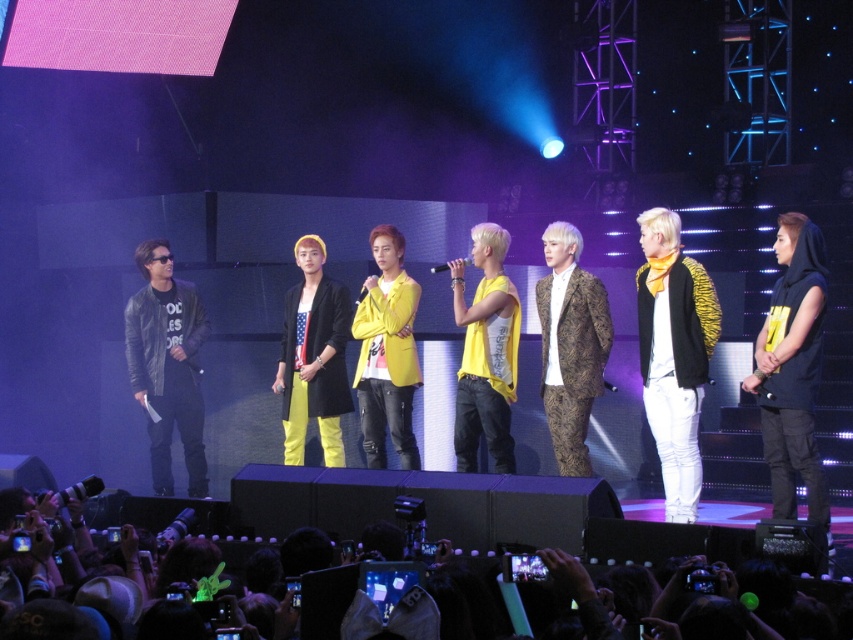
Question: Can you confirm if brown textured suit at center is positioned to the right of yellow fabric jacket at center?

Choices:
 (A) yes
 (B) no

Answer: (A)

Question: Is the position of leather jacket at left more distant than that of yellow fabric jacket at center?

Choices:
 (A) yes
 (B) no

Answer: (B)

Question: Which object is positioned farthest from the yellow matte tank top at center?

Choices:
 (A) leather jacket at left
 (B) black fabric crowd at lower center
 (C) yellow fabric jacket at center
 (D) black jersey at center

Answer: (A)

Question: Which point appears closest to the camera in this image?

Choices:
 (A) (331, 410)
 (B) (585, 403)
 (C) (799, 397)

Answer: (C)

Question: Is yellow tiger-print jacket at center to the right of black jersey at center from the viewer's perspective?

Choices:
 (A) no
 (B) yes

Answer: (A)

Question: Which point appears closest to the camera in this image?

Choices:
 (A) (294, 253)
 (B) (378, 372)
 (C) (819, 486)

Answer: (C)